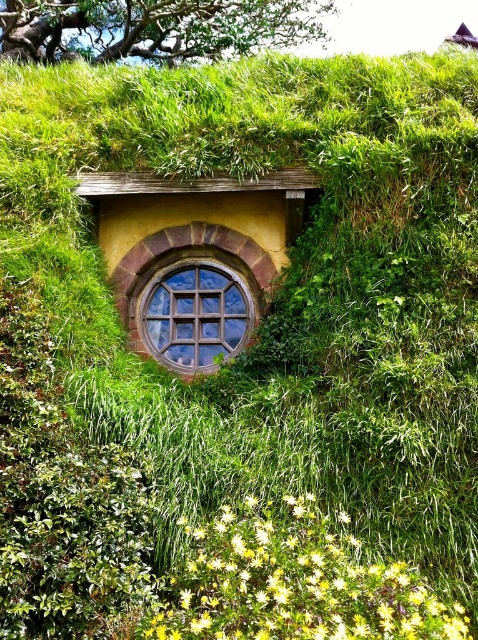
Question: Which of these objects is positioned closest to the green leafy hedge at lower left?

Choices:
 (A) wooden window at center
 (B) wooden grid window at center

Answer: (B)

Question: Which point appears farthest from the camera in this image?

Choices:
 (A) (139, 330)
 (B) (67, 444)
 (C) (228, 269)
 (D) (252, 540)

Answer: (C)

Question: Among these points, which one is farthest from the camera?

Choices:
 (A) (263, 285)
 (B) (241, 273)

Answer: (B)

Question: Does green leafy hedge at lower left appear under wooden grid window at center?

Choices:
 (A) yes
 (B) no

Answer: (A)

Question: Is green leafy hedge at lower left to the right of yellow matte flower at lower center from the viewer's perspective?

Choices:
 (A) no
 (B) yes

Answer: (A)

Question: Is yellow matte flower at lower center behind wooden grid window at center?

Choices:
 (A) yes
 (B) no

Answer: (B)